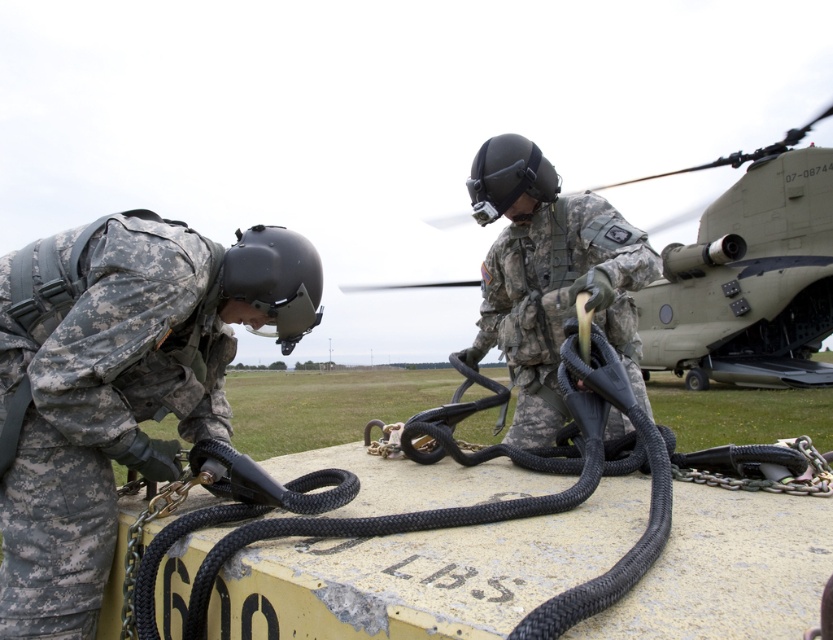
Can you confirm if black braided rope at center is smaller than matte green helicopter at center?

Yes, black braided rope at center is smaller than matte green helicopter at center.

Can you confirm if black braided rope at center is shorter than matte green helicopter at center?

Yes, black braided rope at center is shorter than matte green helicopter at center.

Where is `black braided rope at center`? black braided rope at center is located at coordinates (515, 499).

Identify the location of black braided rope at center. (515, 499).

Between point (38, 538) and point (641, 554), which one is positioned behind?

The point (38, 538) is more distant.

This screenshot has height=640, width=833. Find the location of `camouflage fabric helmet at upper center`. camouflage fabric helmet at upper center is located at coordinates (116, 385).

Is black braided rope at center bigger than camouflage fabric helmet at center?

Yes, black braided rope at center is bigger than camouflage fabric helmet at center.

Is point (247, 624) farther from viewer compared to point (529, 173)?

No, it is not.

Locate an element on the screen. black braided rope at center is located at coordinates (515, 499).